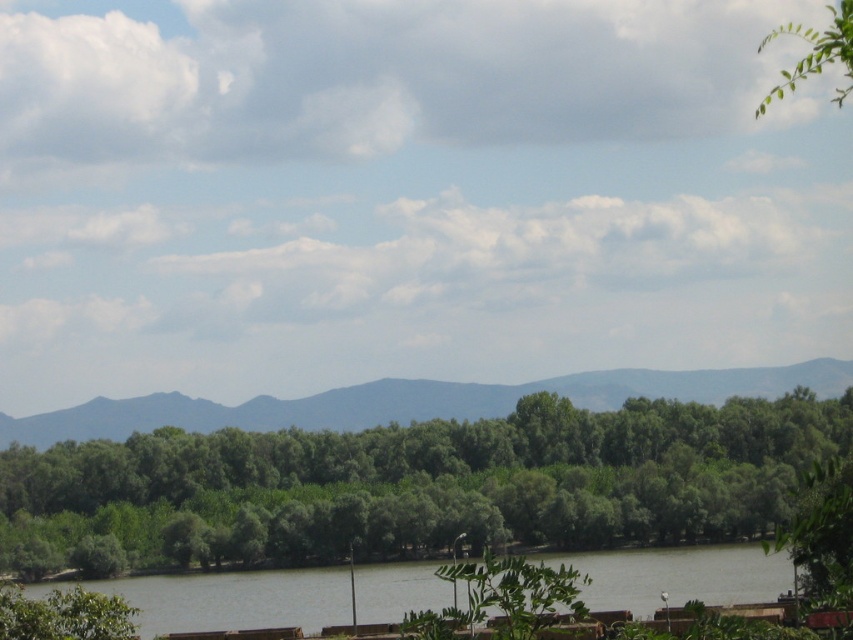
Is green leafy river at center thinner than gray/distant mountain at center?

Yes, green leafy river at center is thinner than gray/distant mountain at center.

The width and height of the screenshot is (853, 640). Describe the element at coordinates (236, 600) in the screenshot. I see `green leafy river at center` at that location.

Where is `green leafy river at center`? This screenshot has width=853, height=640. green leafy river at center is located at coordinates (236, 600).

Between point (396, 429) and point (221, 422), which one is positioned in front?

Point (396, 429) is more forward.

Is point (722, 483) less distant than point (376, 381)?

Yes, point (722, 483) is closer to viewer.

Between point (485, 433) and point (630, 374), which one is positioned behind?

Positioned behind is point (630, 374).

Identify the location of green leafy trees at center. (427, 481).

Who is more distant from viewer, (450,492) or (842,65)?

Point (450,492)

Is green leafy trees at center bigger than green leafy tree at upper right?

No.

What do you see at coordinates (427, 481) in the screenshot? The width and height of the screenshot is (853, 640). I see `green leafy trees at center` at bounding box center [427, 481].

At what (x,y) coordinates should I click in order to perform the action: click on green leafy trees at center. Please return your answer as a coordinate pair (x, y). Image resolution: width=853 pixels, height=640 pixels. Looking at the image, I should click on 427,481.